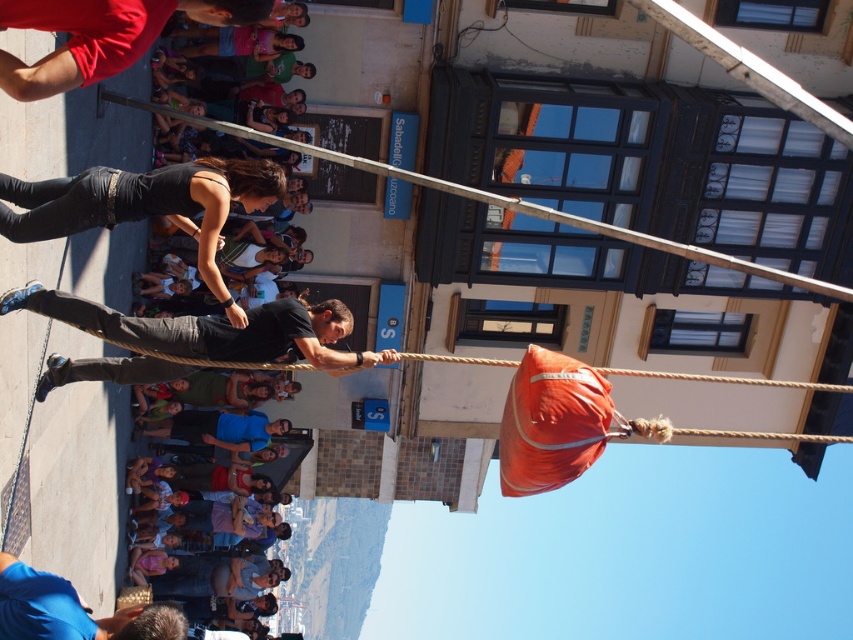
You are a photographer standing at the base of the tightrope setup. You want to take a photo that includes both the red fabric shirt at upper left and the orange fabric bag at center. What is the minimum distance you need to move backward to ensure both objects are in frame?

The red fabric shirt at upper left and orange fabric bag at center are 69.39 feet apart from each other. To include both in the photo, you need to move backward at least 69.39 feet so that the entire distance between them fits within the camera frame.

You are an observer looking at the street performance. You notice the black matte shirt at center and the red fabric shirt at upper left. Which one is positioned to the right of the other?

The black matte shirt at center is positioned to the right of the red fabric shirt at upper left.

You are a tightrope walker preparing to cross a high rope. You notice the black matte shirt at center and the orange fabric bag at center in your path. How far apart are these two objects from each other?

The black matte shirt at center is 8.92 meters from the orange fabric bag at center.